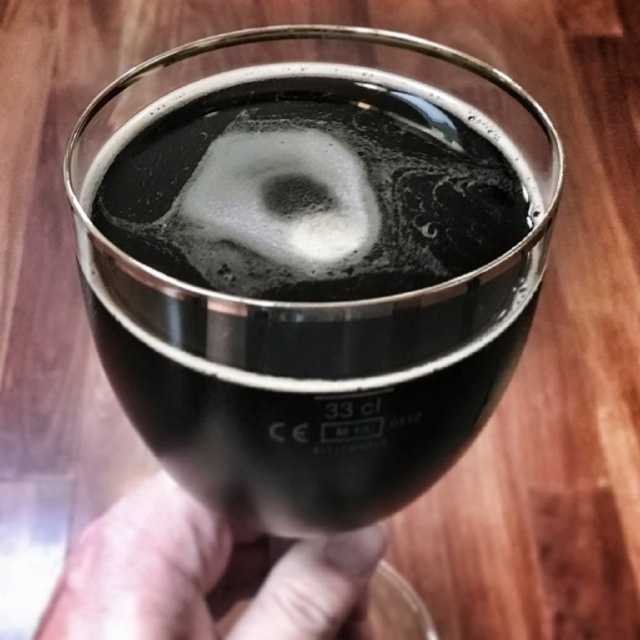
Question: Can you confirm if shiny black glass at center is thinner than skinny white hand at lower center?

Choices:
 (A) no
 (B) yes

Answer: (A)

Question: Where is shiny black glass at center located in relation to skinny white hand at lower center in the image?

Choices:
 (A) below
 (B) above

Answer: (B)

Question: Does shiny black glass at center have a larger size compared to white frothy foam at center?

Choices:
 (A) no
 (B) yes

Answer: (B)

Question: Based on their relative distances, which object is farther from the white frothy foam at center?

Choices:
 (A) skinny white hand at lower center
 (B) shiny black glass at center

Answer: (A)

Question: Which point is closer to the camera?

Choices:
 (A) skinny white hand at lower center
 (B) shiny black glass at center
 (C) white frothy foam at center

Answer: (B)

Question: Which object is closer to the camera taking this photo?

Choices:
 (A) shiny black glass at center
 (B) white frothy foam at center

Answer: (A)